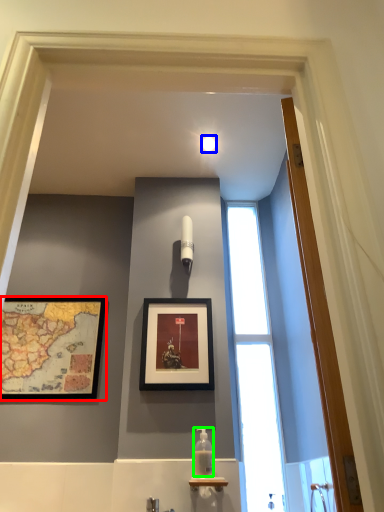
Question: Considering the real-world distances, which object is farthest from picture frame (highlighted by a red box)? light fixture (highlighted by a blue box) or bottle (highlighted by a green box)?

Choices:
 (A) light fixture
 (B) bottle

Answer: (A)